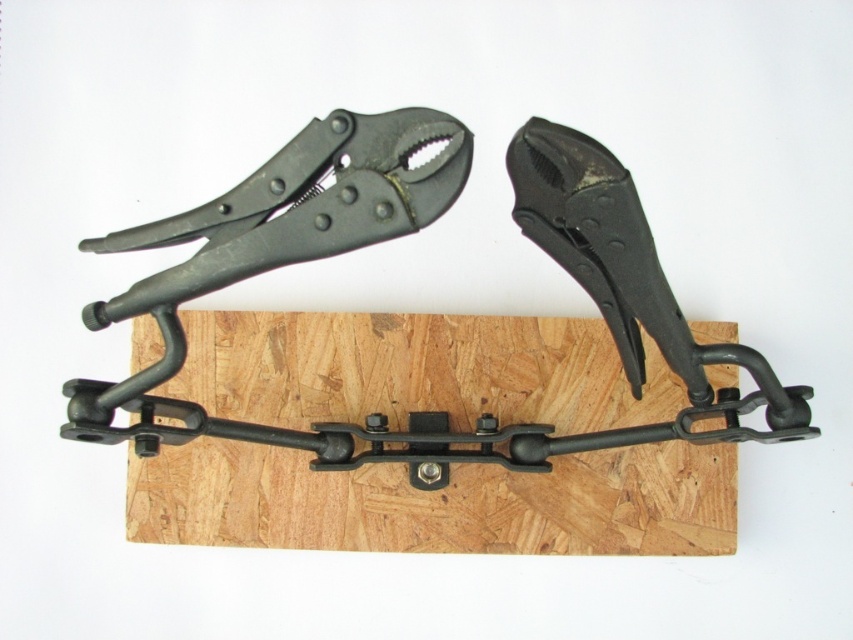
From the picture: Can you confirm if black metal plank at center is bigger than matte black pliers at upper center?

Actually, black metal plank at center might be smaller than matte black pliers at upper center.

The width and height of the screenshot is (853, 640). Describe the element at coordinates (438, 502) in the screenshot. I see `black metal plank at center` at that location.

Is point (651, 392) positioned in front of point (549, 225)?

No.

You are a GUI agent. You are given a task and a screenshot of the screen. Output one action in this format:
    pyautogui.click(x=<x>, y=<y>)
    Task: Click on the black metal plank at center
    
    Given the screenshot: What is the action you would take?
    pyautogui.click(x=438, y=502)